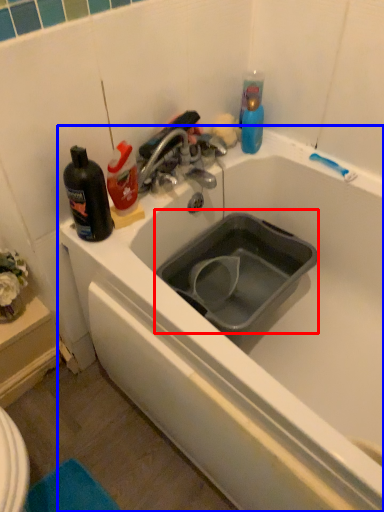
Question: Which object is closer to the camera taking this photo, sink (highlighted by a red box) or bathtub (highlighted by a blue box)?

Choices:
 (A) sink
 (B) bathtub

Answer: (B)